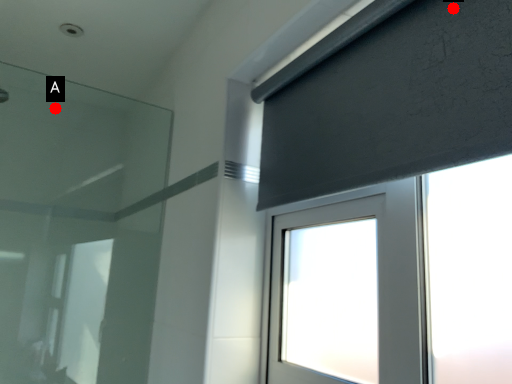
Question: Two points are circled on the image, labeled by A and B beside each circle. Which of the following is the closest to the observer?

Choices:
 (A) A is closer
 (B) B is closer

Answer: (B)